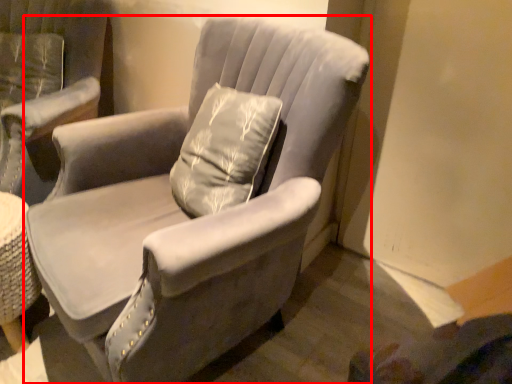
Question: Where is chair (annotated by the red box) located in relation to chair in the image?

Choices:
 (A) left
 (B) right

Answer: (B)